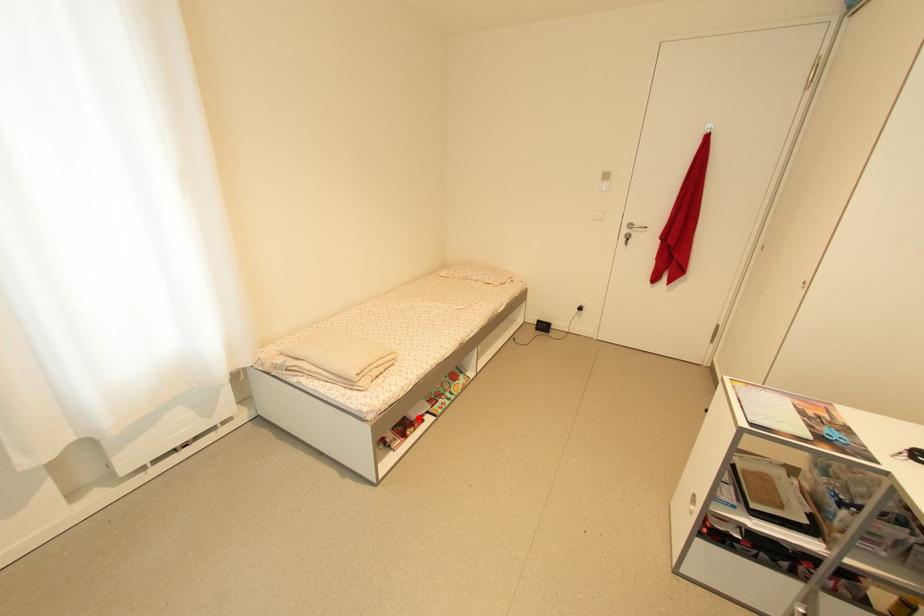
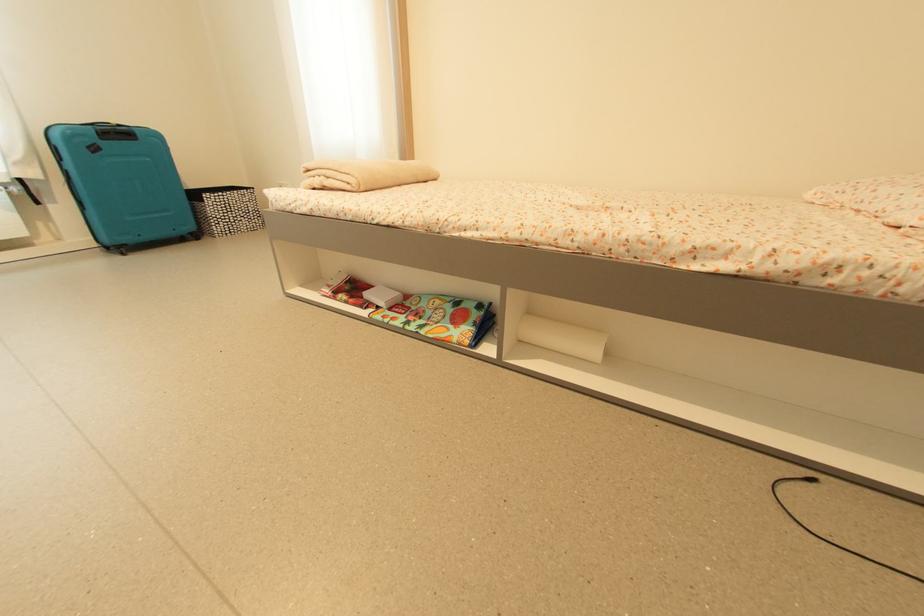
In the second image, find the point that corresponds to the highlighted location in the first image.

(371, 296)